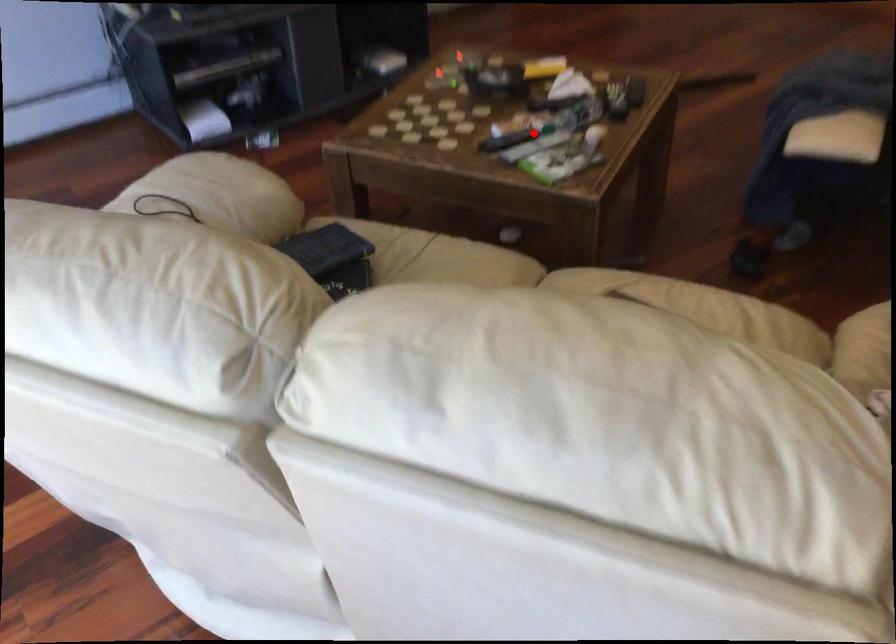
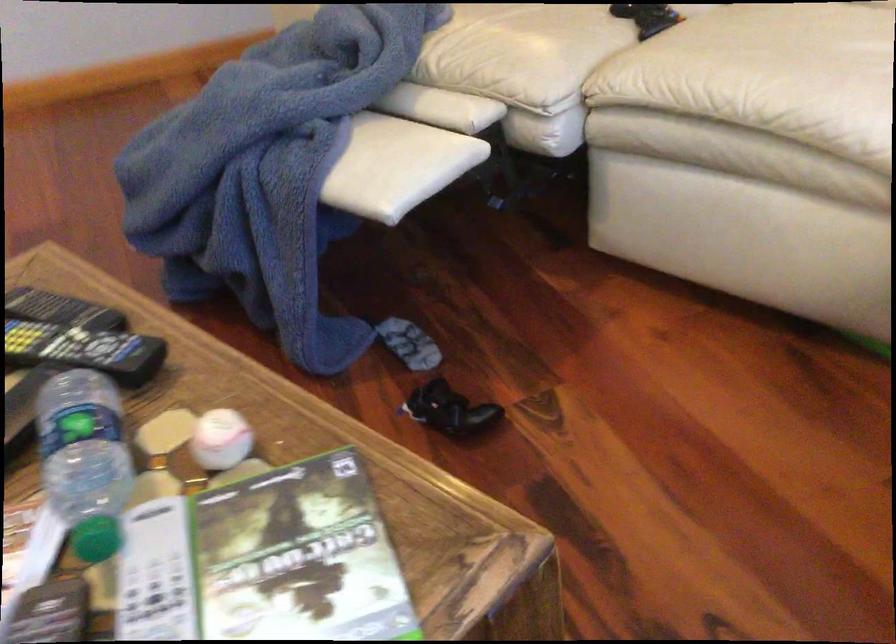
Question: I am providing you with two images of the same scene from different viewpoints. A red point is marked on the first image. Can you still see the location of the red point in image 2?

Choices:
 (A) Yes
 (B) No

Answer: (A)